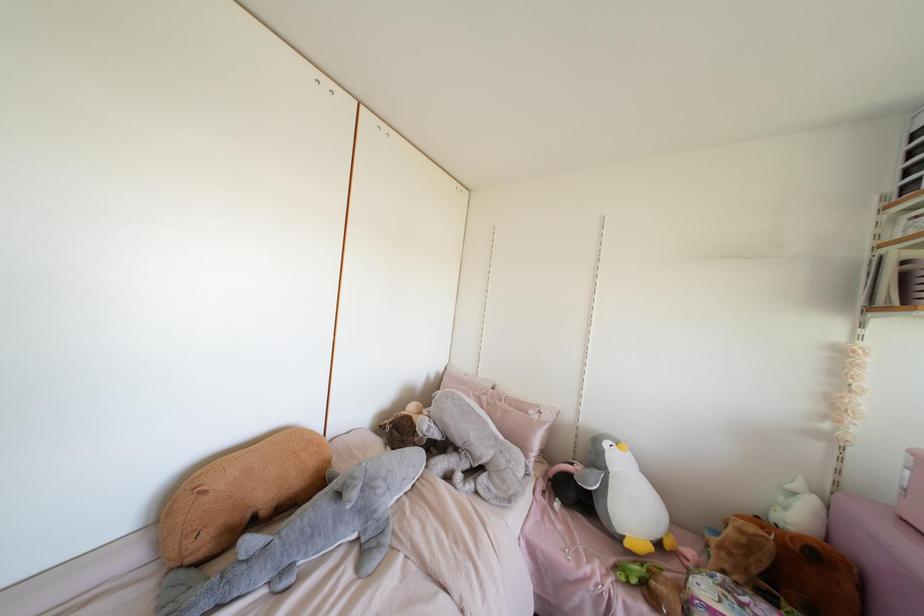
What are the coordinates of `grey shark pillow` in the screenshot? It's located at (304, 536).